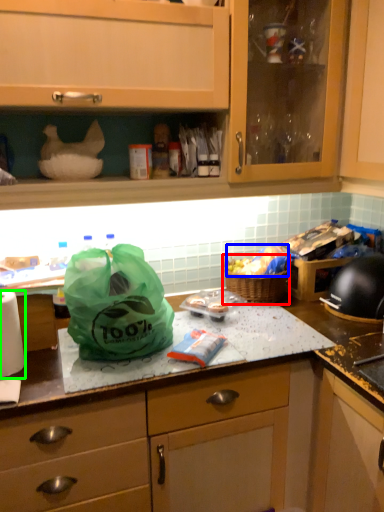
Question: Considering the real-world distances, which object is closest to picnic basket (highlighted by a red box)? food (highlighted by a blue box) or paper towel (highlighted by a green box).

Choices:
 (A) food
 (B) paper towel

Answer: (A)